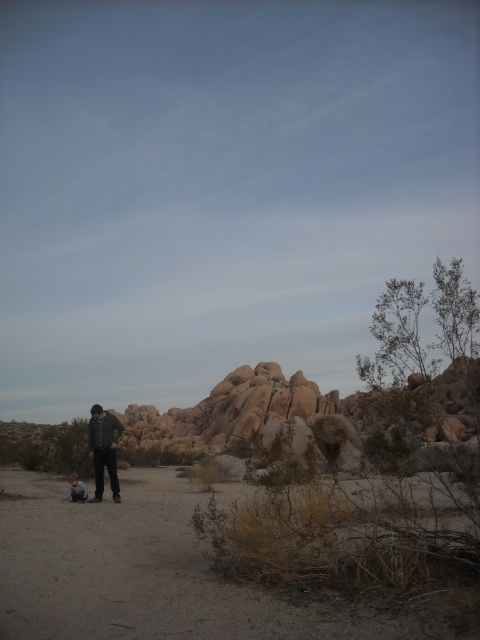
Based on the photo, you are planning a hiking route through the desert and need to ensure safety. The dark gray jacket at center is represented by point (104, 449). Is the dark gray jacket at center located in the midground or the foreground?

The dark gray jacket at center is located in the midground because it is represented by point (104, 449).

You are a photographer trying to capture the desert scene. You notice two points in the image at coordinates point (110,448) and point (83,483). Which point is positioned closer to the camera?

Point (110,448) is closer to the camera than point (83,483).